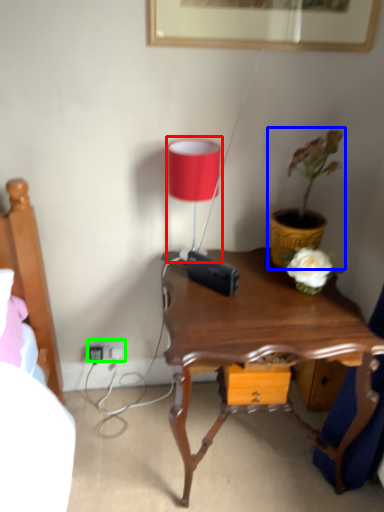
Question: Considering the real-world distances, which object is closest to table lamp (highlighted by a red box)? houseplant (highlighted by a blue box) or electric outlet (highlighted by a green box).

Choices:
 (A) houseplant
 (B) electric outlet

Answer: (A)